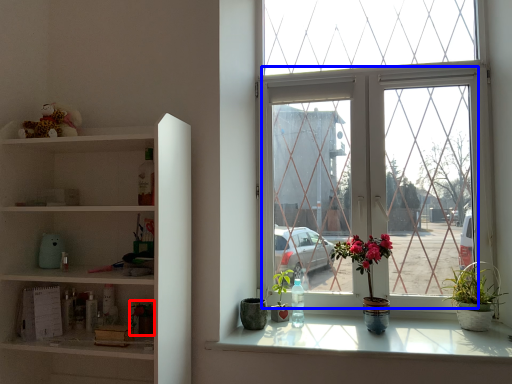
Question: Which object is closer to the camera taking this photo, houseplant (highlighted by a red box) or glass window (highlighted by a blue box)?

Choices:
 (A) houseplant
 (B) glass window

Answer: (A)